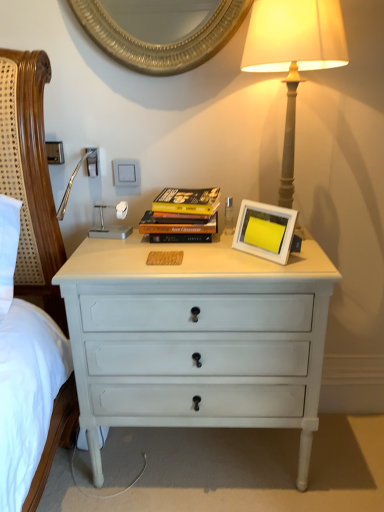
The height and width of the screenshot is (512, 384). Find the location of `free space in front of white matte picture frame at center`. free space in front of white matte picture frame at center is located at coordinates (273, 264).